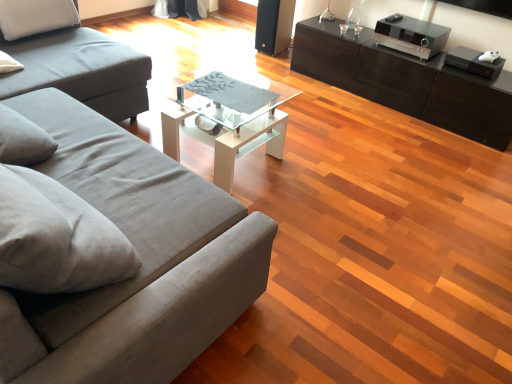
Question: Is the position of clear glass coffee table at center less distant than that of gray fabric couch at left, the second studio couch positioned from the back?

Choices:
 (A) yes
 (B) no

Answer: (B)

Question: From a real-world perspective, is clear glass coffee table at center over gray fabric couch at left, the first studio couch when ordered from front to back?

Choices:
 (A) no
 (B) yes

Answer: (A)

Question: Does clear glass coffee table at center have a lesser height compared to gray fabric couch at left, the first studio couch when ordered from front to back?

Choices:
 (A) yes
 (B) no

Answer: (A)

Question: Can you confirm if clear glass coffee table at center is positioned to the left of gray fabric couch at left, the first studio couch when ordered from front to back?

Choices:
 (A) yes
 (B) no

Answer: (B)

Question: Considering the relative sizes of clear glass coffee table at center and gray fabric couch at left, the first studio couch when ordered from front to back, in the image provided, is clear glass coffee table at center wider than gray fabric couch at left, the first studio couch when ordered from front to back,?

Choices:
 (A) no
 (B) yes

Answer: (A)

Question: Does clear glass coffee table at center have a larger size compared to gray fabric couch at left, the second studio couch positioned from the back?

Choices:
 (A) yes
 (B) no

Answer: (B)

Question: Is black glossy cabinet at right thinner than clear glass coffee table at center?

Choices:
 (A) yes
 (B) no

Answer: (A)

Question: From a real-world perspective, is black glossy cabinet at right positioned under clear glass coffee table at center based on gravity?

Choices:
 (A) no
 (B) yes

Answer: (B)

Question: Is black glossy cabinet at right looking in the opposite direction of clear glass coffee table at center?

Choices:
 (A) yes
 (B) no

Answer: (B)

Question: Considering the relative positions of black glossy cabinet at right and clear glass coffee table at center in the image provided, is black glossy cabinet at right to the left of clear glass coffee table at center from the viewer's perspective?

Choices:
 (A) yes
 (B) no

Answer: (B)

Question: Would you say black glossy cabinet at right contains clear glass coffee table at center?

Choices:
 (A) no
 (B) yes

Answer: (A)

Question: From the image's perspective, is black glossy cabinet at right on top of clear glass coffee table at center?

Choices:
 (A) no
 (B) yes

Answer: (B)

Question: Is clear glass coffee table at center closer to the viewer compared to matte gray fabric studio couch at left, arranged as the 2th studio couch when viewed from the front?

Choices:
 (A) yes
 (B) no

Answer: (B)